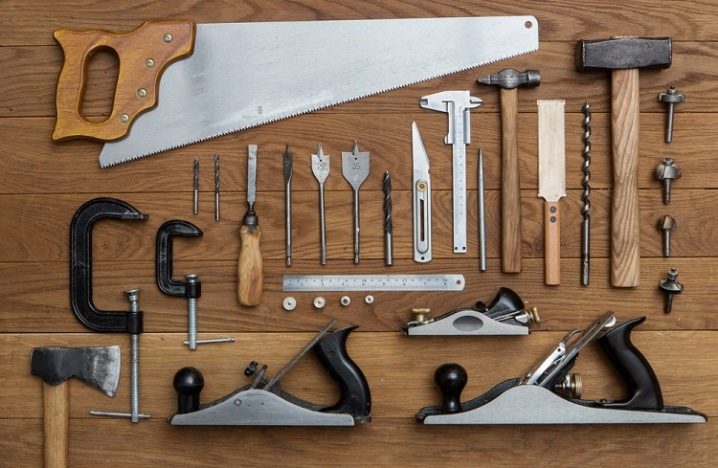
The image size is (718, 468). Identify the location of wood handles. (625, 140), (554, 241), (513, 192), (256, 260), (59, 412), (72, 102).